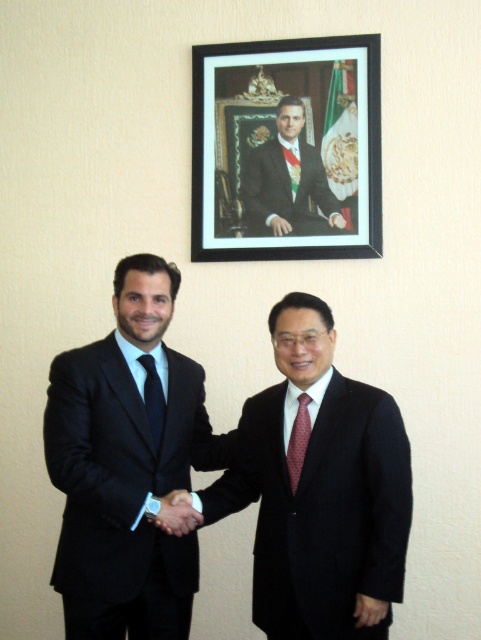
You are a photographer at a formal event. You need to adjust your camera to focus on the smooth leather hand at center while keeping the matte black suit at left in the background. Can you do this without moving your camera position?

Yes, the matte black suit at left is closer to the viewer than the smooth leather hand at center, so adjusting the focus to the hand at center would require a shallow depth of field to blur the closer suit in the background.

You are a photographer at a professional event. You need to capture a closeup shot of both the smooth leather hand at center and the black silk tie at center. Given that your camera can only focus on one object at a time, which object should you focus on first to ensure proper framing, considering their sizes?

The smooth leather hand at center has a larger width than the black silk tie at center, so you should focus on the smooth leather hand at center first to ensure proper framing.